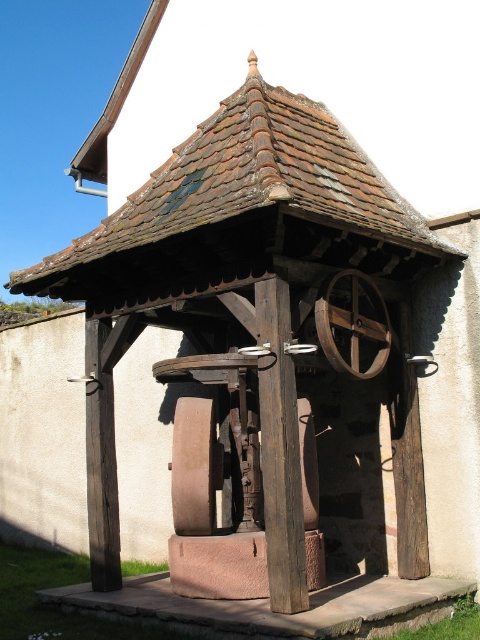
Is point (380, 314) less distant than point (192, 464)?

No.

Does point (375, 369) come in front of point (170, 483)?

Yes.

Where is `wooden wheel at center`? This screenshot has height=640, width=480. wooden wheel at center is located at coordinates (352, 324).